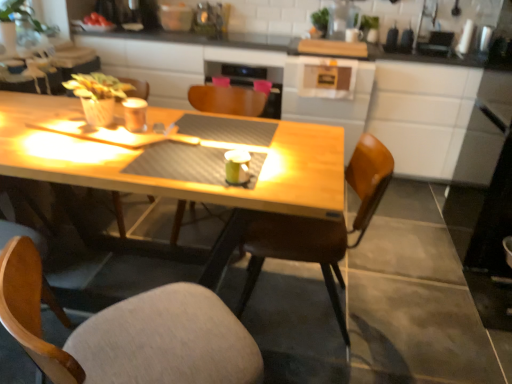
Image resolution: width=512 pixels, height=384 pixels. I want to click on vacant space situated on the left part of matte metallic cup at center, placed as the 2th coffee cup when sorted from front to back, so click(101, 130).